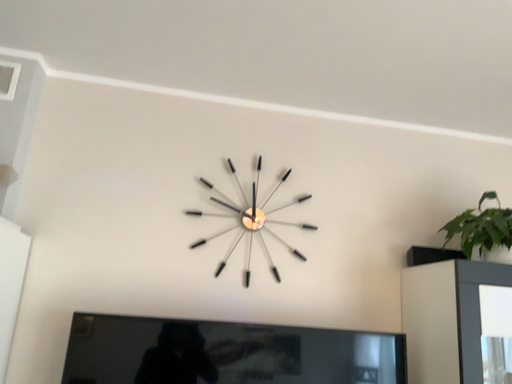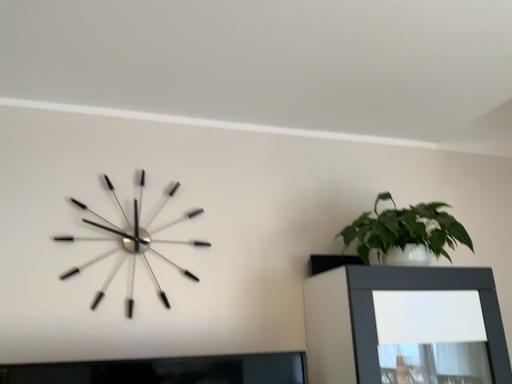
Question: How did the camera likely rotate when shooting the video?

Choices:
 (A) rotated right
 (B) rotated left

Answer: (A)